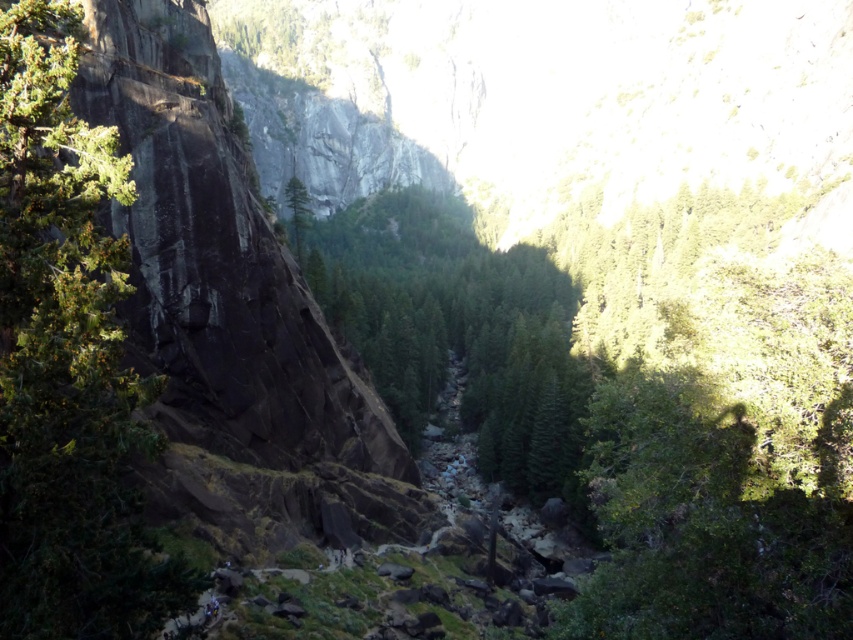
Can you confirm if green textured rock at left is positioned below green textured tree at center?

Yes, green textured rock at left is below green textured tree at center.

Is green textured rock at left to the left of green textured tree at center from the viewer's perspective?

Correct, you'll find green textured rock at left to the left of green textured tree at center.

Which is in front, point (47, 468) or point (480, 417)?

Point (47, 468)

Find the location of a particular element. Image resolution: width=853 pixels, height=640 pixels. green textured rock at left is located at coordinates (67, 362).